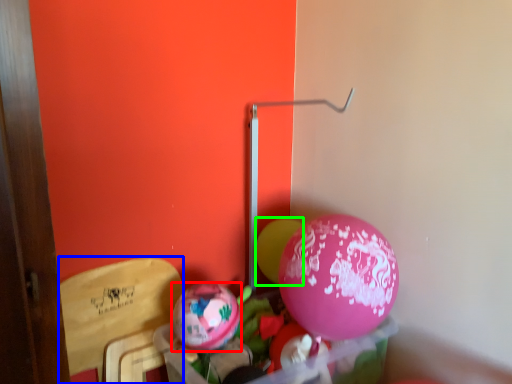
Question: Which object is positioned farthest from balloon (highlighted by a red box)? Select from armchair (highlighted by a blue box) and balloon (highlighted by a green box).

Choices:
 (A) armchair
 (B) balloon

Answer: (B)